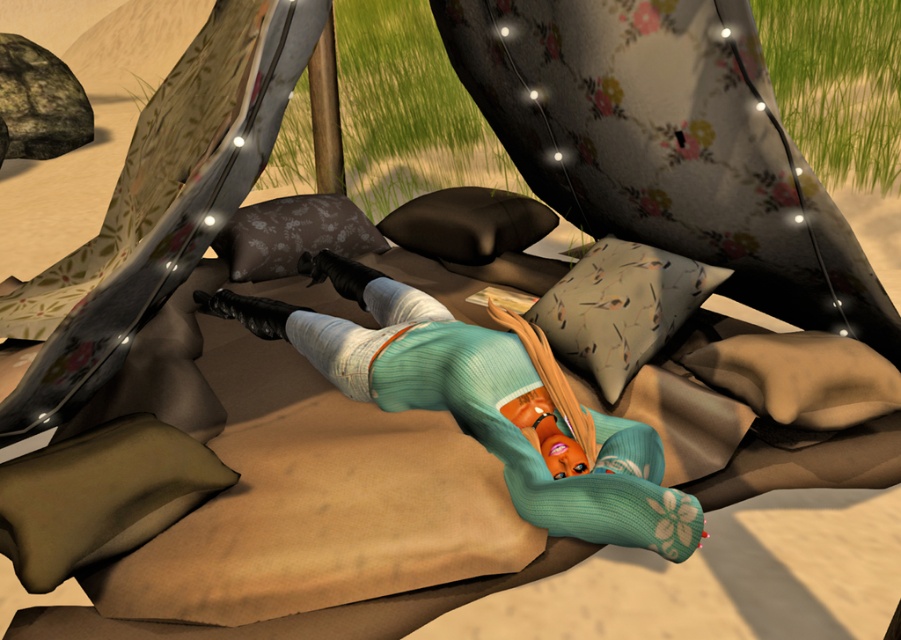
You are a photographer trying to capture a closeup shot of the character. You notice two points in the scene marked as point 1 at coordinates point (67, 483) and point 2 at coordinates point (505, 230). Which point should you focus on to ensure the character is in sharp focus?

Point 1 at coordinates point (67, 483) is closer to the camera than point 2 at coordinates point (505, 230), so focusing on point 1 will ensure the character is in sharp focus.

You are setting up a camping scene and need to place two pillows for comfort. You have the dark olive green fabric pillow at lower left and the black matte pillow at center. According to the scene, which pillow is closer to you?

The dark olive green fabric pillow at lower left is closer to you because it is in front of the black matte pillow at center.

You are setting up a cozy outdoor bed for a camping trip. You have two pillows to place under your head. The floral fabric pillow at upper center and the black matte pillow at center. Which pillow should you choose if you want the higher one for better neck support?

The floral fabric pillow at upper center has a greater height compared to the black matte pillow at center, so you should choose the floral fabric pillow at upper center for better neck support.